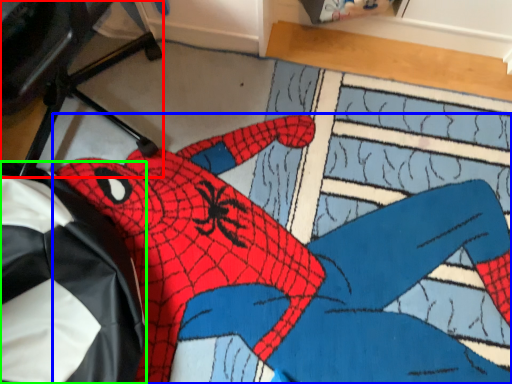
Question: Estimate the real-world distances between objects in this image. Which object is closer to computer chair (highlighted by a red box), person (highlighted by a blue box) or bean bag chair (highlighted by a green box)?

Choices:
 (A) person
 (B) bean bag chair

Answer: (B)